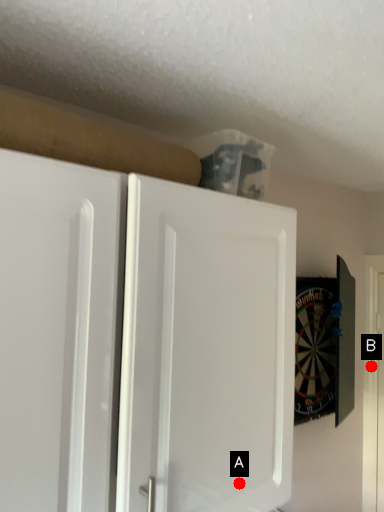
Question: Two points are circled on the image, labeled by A and B beside each circle. Which of the following is the farthest from the observer?

Choices:
 (A) A is further
 (B) B is further

Answer: (B)